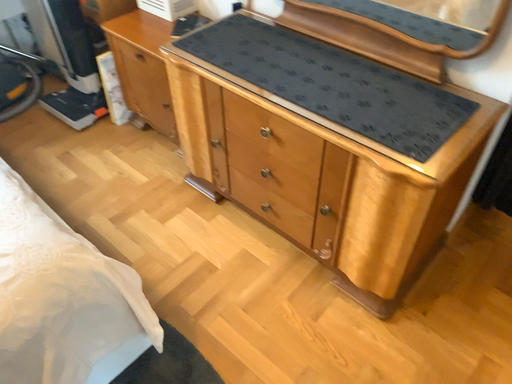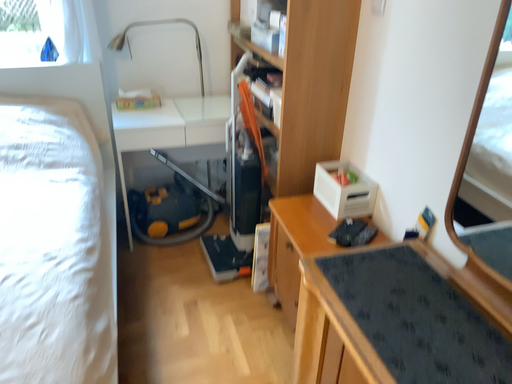
Question: How did the camera likely rotate when shooting the video?

Choices:
 (A) rotated upward
 (B) rotated downward

Answer: (A)